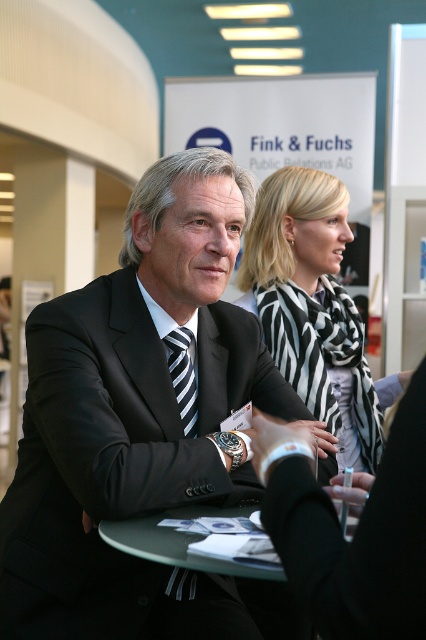
Who is positioned more to the right, matte black suit at center or striped fabric tie at center?

matte black suit at center

Image resolution: width=426 pixels, height=640 pixels. What do you see at coordinates (138, 419) in the screenshot?
I see `matte black suit at center` at bounding box center [138, 419].

Where is `matte black suit at center`? This screenshot has height=640, width=426. matte black suit at center is located at coordinates (138, 419).

Does matte black suit at center have a greater height compared to black and white scarf at upper center?

No.

Consider the image. Is matte black suit at center smaller than black and white scarf at upper center?

No.

Is point (141, 232) farther from camera compared to point (305, 198)?

No, (141, 232) is in front of (305, 198).

Identify the location of matte black suit at center. (138, 419).

Looking at this image, does black and white scarf at upper center appear on the right side of striped fabric tie at center?

Correct, you'll find black and white scarf at upper center to the right of striped fabric tie at center.

Can you confirm if black and white scarf at upper center is positioned to the left of striped fabric tie at center?

Incorrect, black and white scarf at upper center is not on the left side of striped fabric tie at center.

This screenshot has height=640, width=426. Describe the element at coordinates (310, 301) in the screenshot. I see `black and white scarf at upper center` at that location.

The width and height of the screenshot is (426, 640). I want to click on black and white scarf at upper center, so click(310, 301).